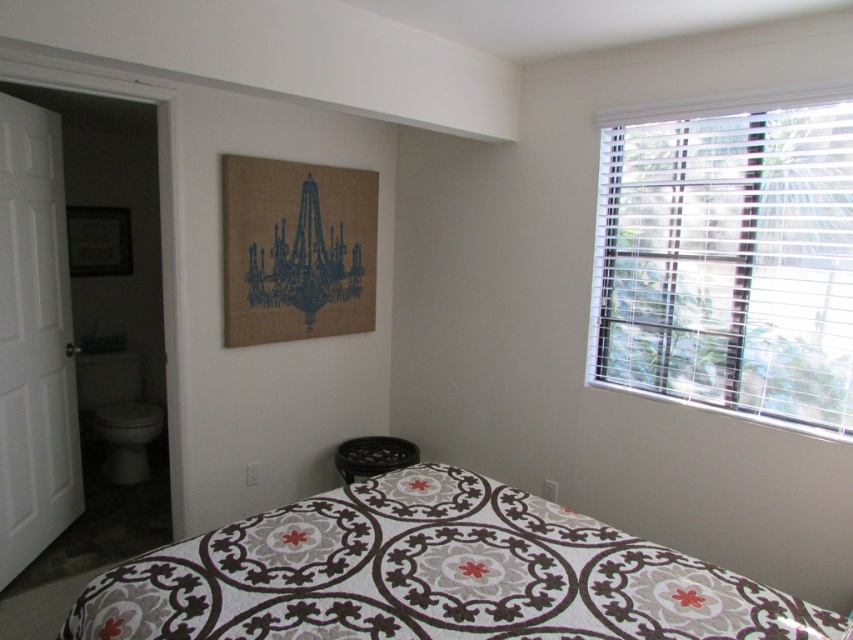
You are standing in the bedroom and want to place a 1.5 meter long ladder against the wall near the patterned fabric bed at center. Is there enough space between you and the bed to safely place the ladder?

The distance between you and the patterned fabric bed at center is 1.49 meters, which is slightly less than the ladder length of 1.5 meters. Therefore, there is not enough space to safely place the ladder.

You are standing in the bedroom and want to place a new lamp on the wall above the patterned fabric bed at center. The lamp will be placed at the same position as point (431,576). Is there enough space for the lamp?

The patterned fabric bed at center is represented by point (431,576), so placing the lamp there would be on the bed itself, not the wall above. Therefore, there is no space for the lamp on the wall above the bed at that coordinate.

You are organizing a small party in the bedroom and need to place a 1.5 meter long table. The table must be placed near the patterned fabric bed at center and the white blinds at upper right. Based on their sizes, which object can accommodate the table better?

The white blinds at upper right can accommodate the table better since they occupy more space than the patterned fabric bed at center.